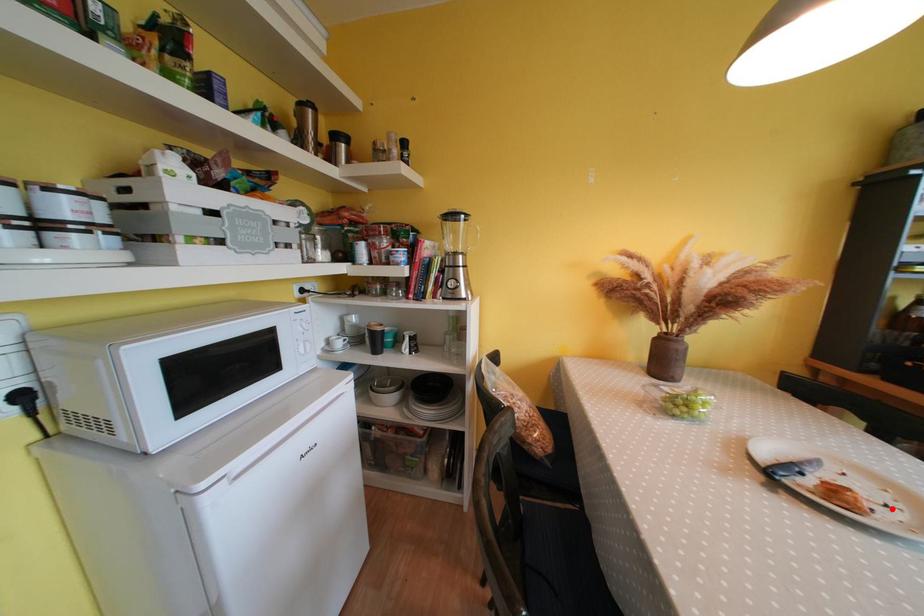
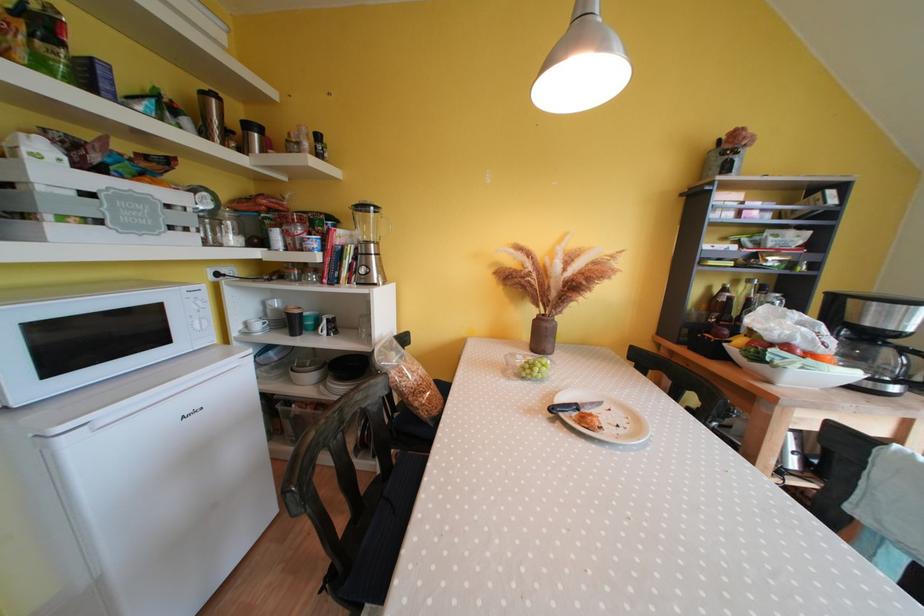
Where in the second image is the point corresponding to the highlighted location from the first image?

(624, 430)